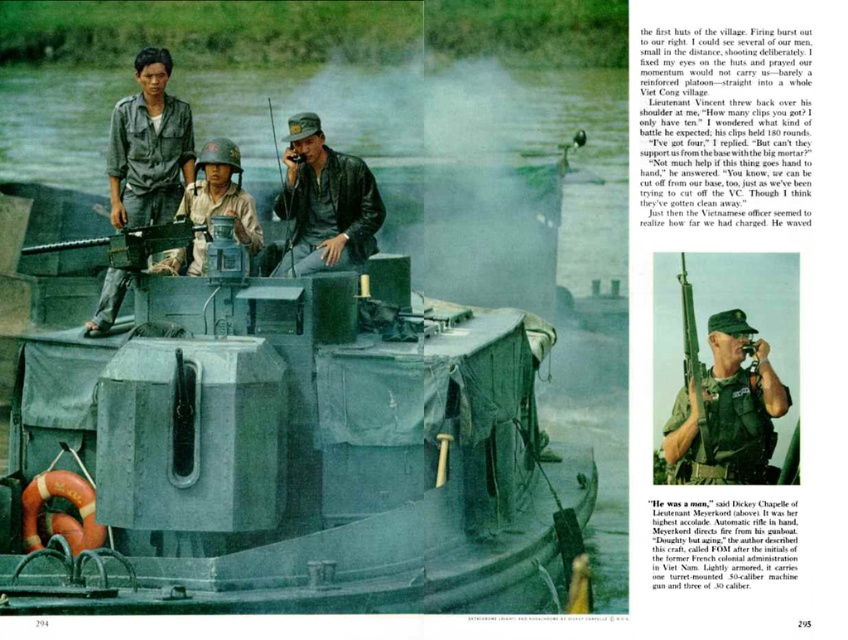
You are a drone operator controlling a surveillance drone. Your mission is to locate two objects on the left side of the image. The objects are the camouflage fabric uniform at upper left and the camouflage fabric helmet at center. Your drone has a maximum range of 4 meters. Can your drone reach both objects without exceeding its range?

The camouflage fabric uniform at upper left is 4.13 meters away from the camouflage fabric helmet at center. Since the distance between them is slightly over the drone operator maximum range of 4 meters, the drone cannot reach both objects without exceeding its range.

You are a military analyst assessing the equipment in the left section of the image. Which object, the camouflage fabric uniform at upper left or the camouflage fabric helmet at center, would you say is bigger in size?

The camouflage fabric uniform at upper left is larger in size compared to the camouflage fabric helmet at center.